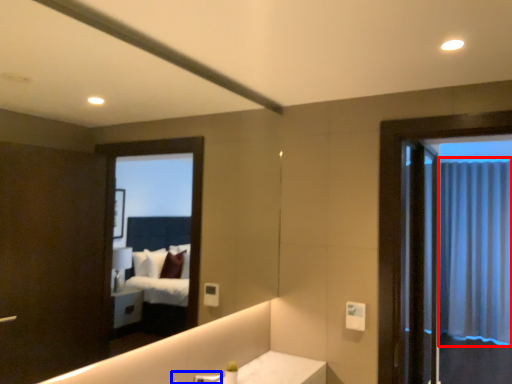
Question: Among these objects, which one is nearest to the camera, curtain (highlighted by a red box) or faucet (highlighted by a blue box)?

Choices:
 (A) curtain
 (B) faucet

Answer: (B)